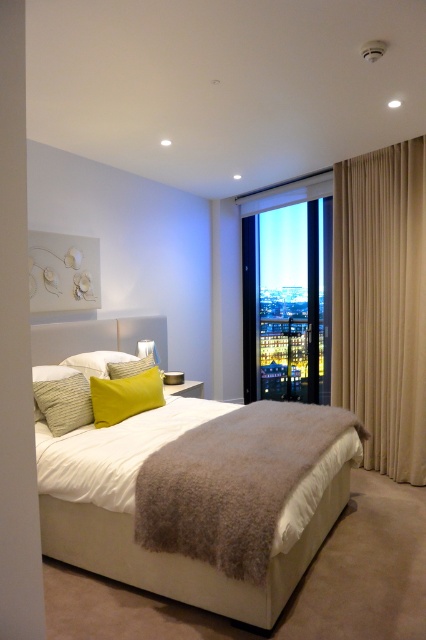
You are standing in the center of the room and want to move to the white soft bed at center. Which direction should you move?

Since the white soft bed at center is located at point (x=199, y=499) in the 2D space, you should move towards the left to reach it.

You are standing in the bedroom and want to exit through the door. You see the transparent glass door at center and the yellow fabric pillow at center. Which one should you walk towards to leave the room?

You should walk towards the transparent glass door at center to exit the room since doors are typically used for exiting, and it is larger in size than the yellow fabric pillow at center, making it more likely to be the exit.